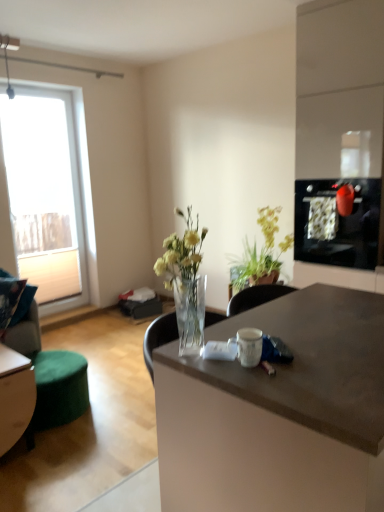
The height and width of the screenshot is (512, 384). What do you see at coordinates (51, 374) in the screenshot?
I see `green fabric swivel chair at lower left` at bounding box center [51, 374].

Where is `white matte coffee cup at center`? white matte coffee cup at center is located at coordinates (248, 346).

In order to face matte black oven at right, should I rotate leftwards or rightwards?

To face it directly, rotate right by 20.677 degrees.

This screenshot has width=384, height=512. What do you see at coordinates (337, 223) in the screenshot?
I see `black glass screen door at upper right` at bounding box center [337, 223].

Locate an element on the screen. The height and width of the screenshot is (512, 384). green fabric swivel chair at lower left is located at coordinates (51, 374).

Is matte black oven at right in front of or behind green leafy plant at center in the image?

In the image, matte black oven at right appears in front of green leafy plant at center.

Based on the photo, is matte black oven at right positioned with its back to green leafy plant at center?

No, matte black oven at right is not facing the opposite direction of green leafy plant at center.

Looking at this image, who is taller, matte black oven at right or green leafy plant at center?

matte black oven at right is taller.

From their relative heights in the image, would you say matte brown desk at center is taller or shorter than transparent glass window at left?

In the image, matte brown desk at center appears to be shorter than transparent glass window at left.

Is matte brown desk at center inside or outside of transparent glass window at left?

matte brown desk at center exists outside the volume of transparent glass window at left.

Who is smaller, matte brown desk at center or transparent glass window at left?

With smaller size is transparent glass window at left.

Does matte brown desk at center come behind transparent glass window at left?

No, matte brown desk at center is closer to the camera.

Considering the positions of objects transparent glass window at left and matte brown desk at center in the image provided, who is more to the right, transparent glass window at left or matte brown desk at center?

matte brown desk at center.

From the image's perspective, is transparent glass window at left positioned above or below matte brown desk at center?

Clearly, from the image's perspective, transparent glass window at left is above matte brown desk at center.

Which of these two, transparent glass window at left or matte brown desk at center, is bigger?

matte brown desk at center is bigger.

From a real-world perspective, is transparent glass window at left above or below matte brown desk at center?

From a real-world perspective, transparent glass window at left is physically above matte brown desk at center.

Is transparent glass window at left outside of green fabric ottoman at lower left?

transparent glass window at left lies outside green fabric ottoman at lower left's area.

Is point (57, 147) less distant than point (1, 437)?

No, (57, 147) is behind (1, 437).

Can you confirm if transparent glass window at left is wider than green fabric ottoman at lower left?

No.

What's the angular difference between transparent glass window at left and green fabric ottoman at lower left's facing directions?

They differ by 0.636 degrees in their facing directions.

Is matte brown desk at center aimed at green fabric swivel chair at lower left?

Yes, matte brown desk at center is oriented towards green fabric swivel chair at lower left.

Locate an element on the screen. The height and width of the screenshot is (512, 384). desk in front of the green fabric swivel chair at lower left is located at coordinates (279, 412).

Which object is further away from the camera, matte brown desk at center or green fabric swivel chair at lower left?

green fabric swivel chair at lower left.

Which of these two, matte brown desk at center or green fabric swivel chair at lower left, stands taller?

With more height is matte brown desk at center.

From their relative heights in the image, would you say green fabric ottoman at lower left is taller or shorter than matte black oven at right?

In the image, green fabric ottoman at lower left appears to be shorter than matte black oven at right.

Between point (20, 365) and point (381, 157), which one is positioned behind?

Point (381, 157)

Is green fabric ottoman at lower left wider or thinner than matte black oven at right?

Considering their sizes, green fabric ottoman at lower left looks slimmer than matte black oven at right.

Is green fabric ottoman at lower left directly adjacent to matte black oven at right?

No, green fabric ottoman at lower left is not with matte black oven at right.

From the picture: Considering their positions, is transparent glass window at left located in front of or behind green leafy plant at center?

Clearly, transparent glass window at left is behind green leafy plant at center.

Consider the image. How far apart are transparent glass window at left and green leafy plant at center?

transparent glass window at left and green leafy plant at center are 2.03 meters apart from each other.

From the picture: From a real-world perspective, which object stands above the other?

In real-world perspective, transparent glass window at left is above.

Between point (40, 179) and point (268, 275), which one is positioned behind?

Point (40, 179)

Identify the location of cabinetry above the green leafy plant at center (from the image's perspective). (340, 90).

The width and height of the screenshot is (384, 512). I want to click on desk lying in front of the transparent glass window at left, so click(x=279, y=412).

Considering their positions, is white matte coffee cup at center positioned closer to black glass screen door at upper right than green leafy plant at center?

green leafy plant at center is positioned closer to the anchor black glass screen door at upper right.

From the image, which object appears to be nearer to green leafy plant at center, white matte coffee cup at center or matte brown desk at center?

The object closer to green leafy plant at center is matte brown desk at center.

Looking at the image, which one is located closer to green fabric ottoman at lower left, white matte coffee cup at center or matte brown desk at center?

matte brown desk at center.

Consider the image. When comparing their distances from green fabric ottoman at lower left, does white matte coffee cup at center or matte black oven at right seem further?

Among the two, matte black oven at right is located further to green fabric ottoman at lower left.

Estimate the real-world distances between objects in this image. Which object is closer to green fabric swivel chair at lower left, green fabric ottoman at lower left or matte brown desk at center?

The object closer to green fabric swivel chair at lower left is green fabric ottoman at lower left.

Based on their spatial positions, is green leafy plant at center or green fabric ottoman at lower left closer to matte brown desk at center?

green fabric ottoman at lower left lies closer to matte brown desk at center than the other object.

Based on their spatial positions, is transparent glass window at left or green leafy plant at center closer to green fabric swivel chair at lower left?

Based on the image, green leafy plant at center appears to be nearer to green fabric swivel chair at lower left.

Considering their positions, is white matte coffee cup at center positioned further to matte brown desk at center than green leafy plant at center?

Based on the image, green leafy plant at center appears to be further to matte brown desk at center.

At what (x,y) coordinates should I click in order to perform the action: click on coffee cup located between matte brown desk at center and transparent glass window at left in the depth direction. Please return your answer as a coordinate pair (x, y). Looking at the image, I should click on (248, 346).

Identify the location of table between transparent glass window at left and black glass screen door at upper right. This screenshot has height=512, width=384. (15, 396).

Identify the location of swivel chair between green fabric ottoman at lower left and matte black oven at right from left to right. The image size is (384, 512). (51, 374).

In order to click on table between matte brown desk at center and green leafy plant at center in the front-back direction in this screenshot , I will do coord(15,396).